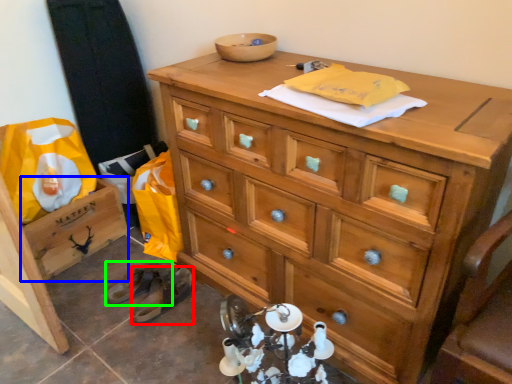
Question: Based on their relative distances, which object is nearer to shoe (highlighted by a red box)? Choose from cabinetry (highlighted by a blue box) and shoe (highlighted by a green box).

Choices:
 (A) cabinetry
 (B) shoe

Answer: (B)